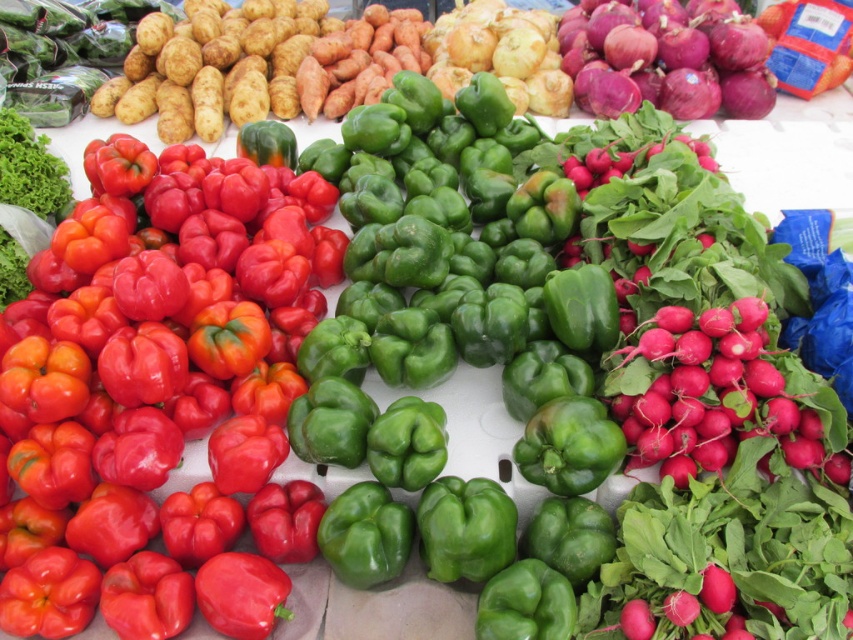
Find the location of a particular element. The image size is (853, 640). shiny red bell pepper at left is located at coordinates (157, 396).

Who is more distant from viewer, (x=196, y=298) or (x=699, y=61)?

The point (x=699, y=61) is more distant.

I want to click on shiny red bell pepper at left, so click(157, 396).